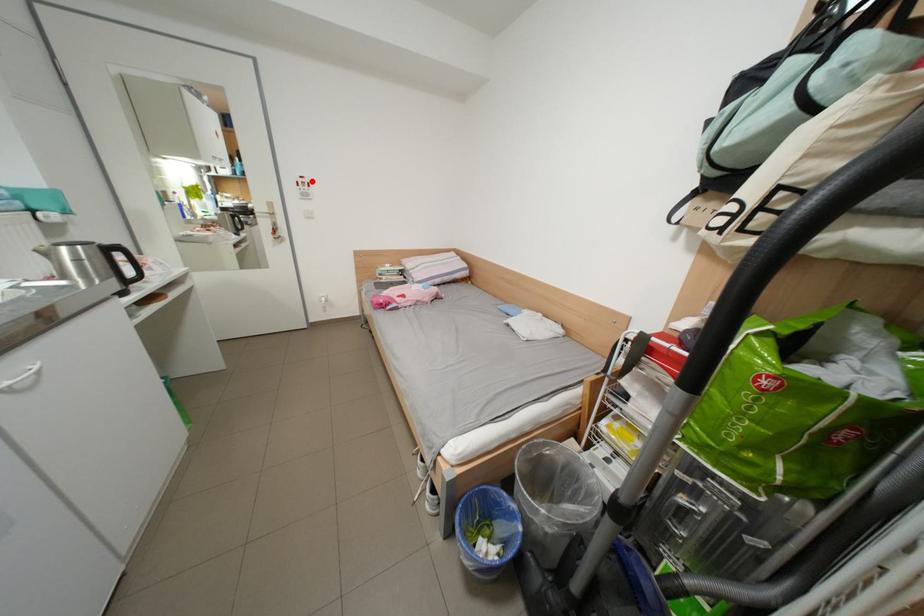
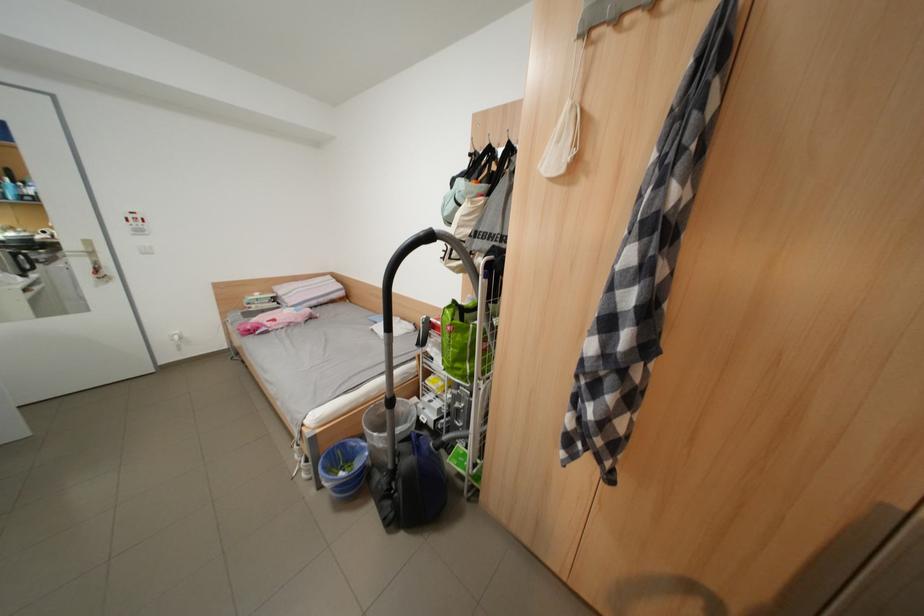
Question: I am providing you with two images of the same scene from different viewpoints. A red point is shown in image1. For the corresponding object point in image2, is it positioned nearer or farther from the camera?

Choices:
 (A) Nearer
 (B) Farther

Answer: (B)